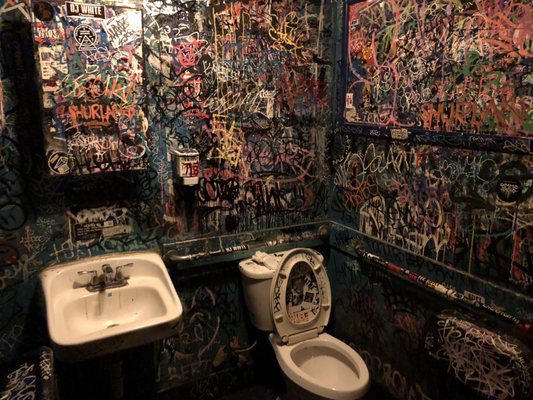
This screenshot has height=400, width=533. What are the coordinates of `top of toilet bowl rim, left side` in the screenshot? It's located at coord(295,370).